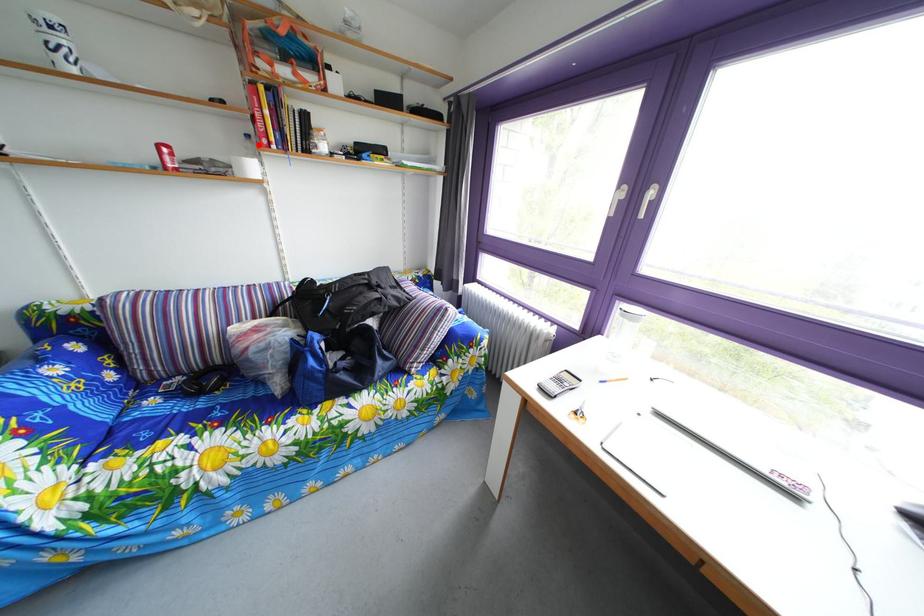
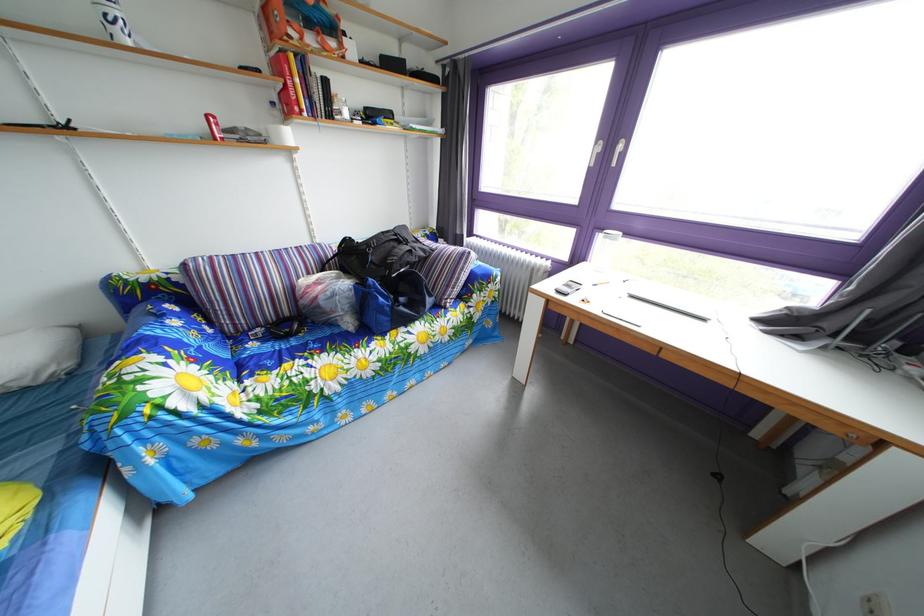
Find the pixel in the second image that matches the highlighted location in the first image.

(284, 111)